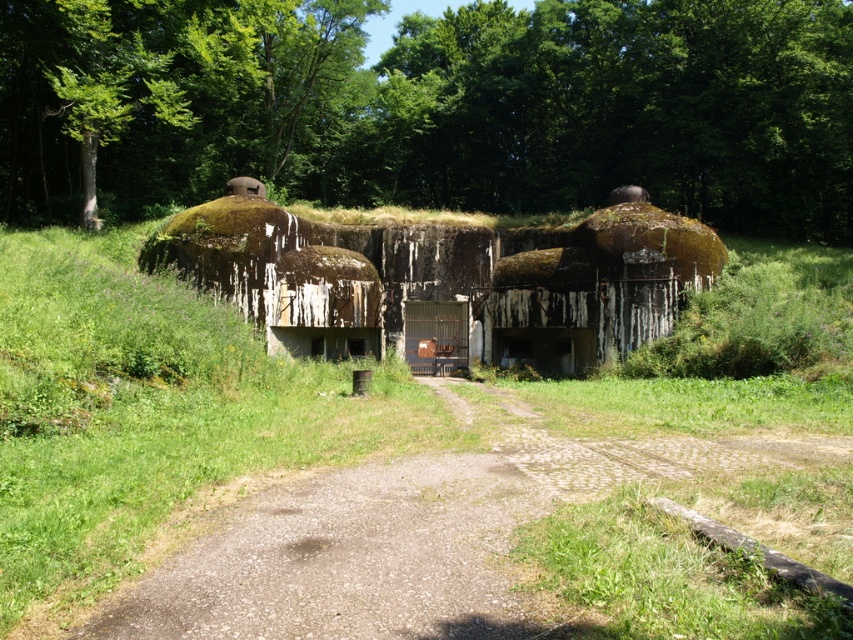
Question: Among these objects, which one is farthest from the camera?

Choices:
 (A) green mossy dome at center
 (B) dirt road at center
 (C) green leafy tree at upper center

Answer: (C)

Question: Among these objects, which one is farthest from the camera?

Choices:
 (A) dirt road at center
 (B) green mossy dome at center

Answer: (B)

Question: Among these objects, which one is farthest from the camera?

Choices:
 (A) green mossy dome at center
 (B) green leafy tree at upper center
 (C) dirt road at center

Answer: (B)

Question: Can you confirm if dirt road at center is bigger than green mossy dome at center?

Choices:
 (A) yes
 (B) no

Answer: (B)

Question: Is green leafy tree at upper center below green mossy dome at center?

Choices:
 (A) yes
 (B) no

Answer: (B)

Question: Does green leafy tree at upper center have a greater width compared to green mossy dome at center?

Choices:
 (A) no
 (B) yes

Answer: (B)